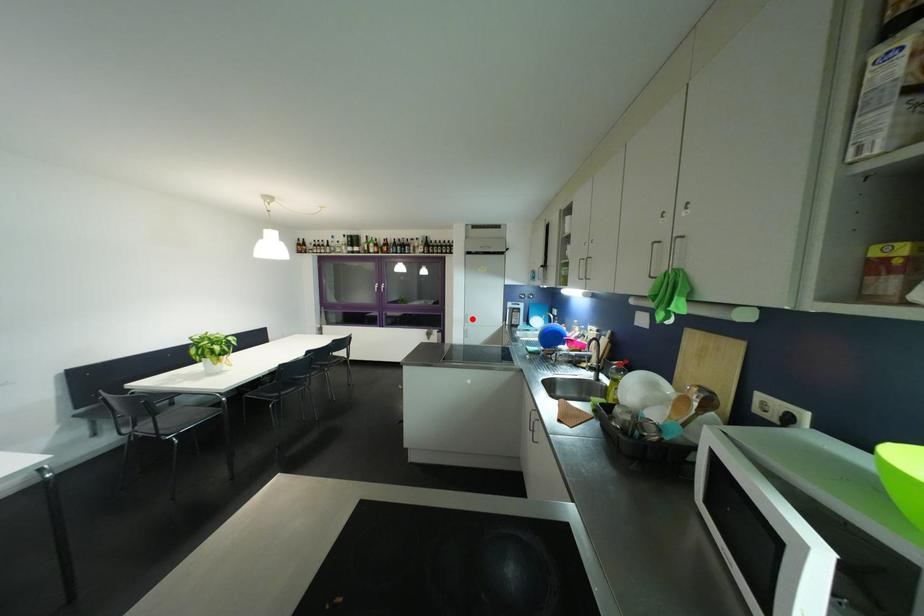
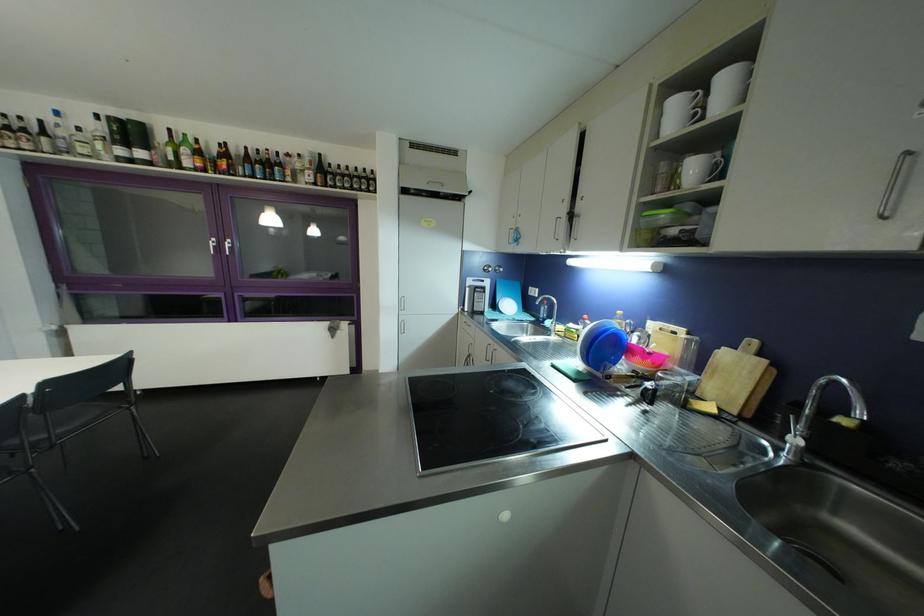
The point at the highlighted location is marked in the first image. Where is the corresponding point in the second image?

(407, 302)